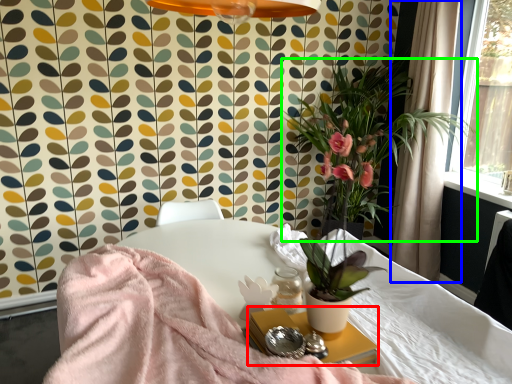
Question: Based on their relative distances, which object is farther from side table (highlighted by a red box)? Choose from curtain (highlighted by a blue box) and houseplant (highlighted by a green box).

Choices:
 (A) curtain
 (B) houseplant

Answer: (A)